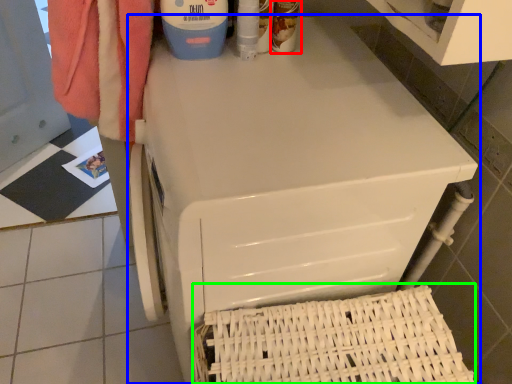
Question: Based on their relative distances, which object is farther from cleaning product (highlighted by a red box)? Choose from home appliance (highlighted by a blue box) and basket (highlighted by a green box).

Choices:
 (A) home appliance
 (B) basket

Answer: (B)